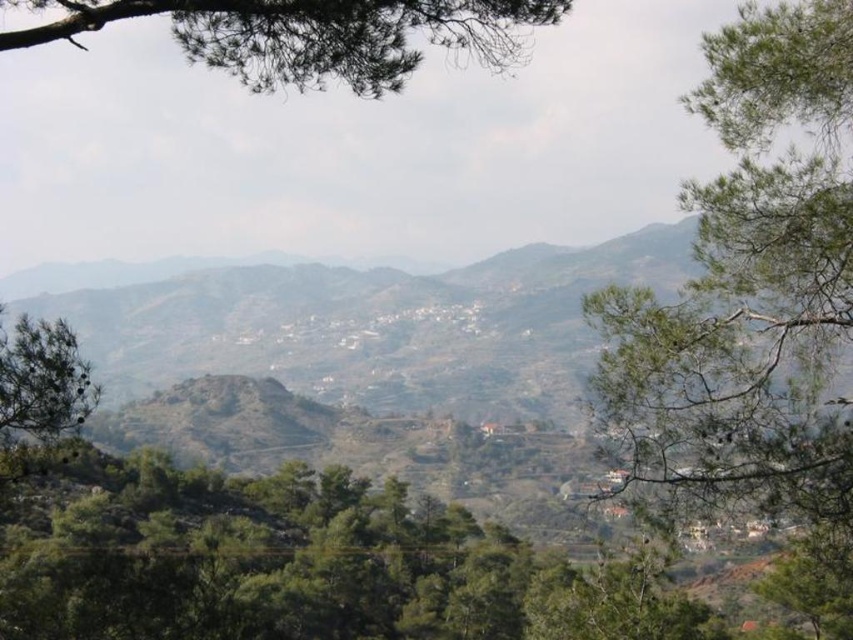
You are a hiker planning to take a photo of the brown rocky mountain at center and the green textured pine tree at left. From your current position, which object will appear closer to you in the photo?

The green textured pine tree at left will appear closer to you in the photo because the brown rocky mountain at center is positioned over it, meaning the pine tree is in the foreground while the mountain is behind.

You are a hiker who wants to place a 2 meter wide tent between the brown rocky mountain at center and another object. Is there enough space?

The distance between the brown rocky mountain at center and the other object is 39.40 meters, so yes, there is enough space to place a 2 meter wide tent between them.